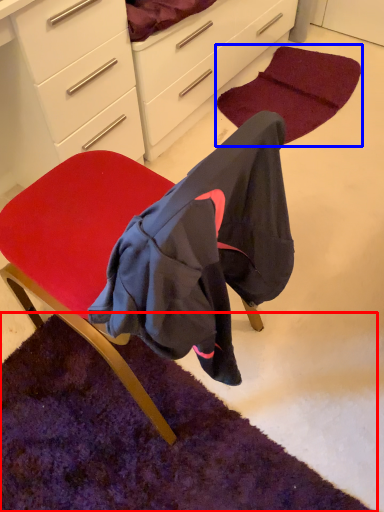
Question: Which object appears closest to the camera in this image, mat (highlighted by a red box) or mat (highlighted by a blue box)?

Choices:
 (A) mat
 (B) mat

Answer: (A)